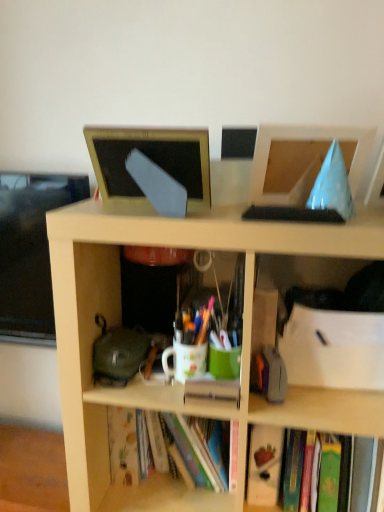
Question: From a real-world perspective, is translucent plastic pen at center physically located above or below hardcover book at lower right?

Choices:
 (A) above
 (B) below

Answer: (A)

Question: Is point (281, 380) closer or farther from the camera than point (357, 505)?

Choices:
 (A) closer
 (B) farther

Answer: (A)

Question: Estimate the real-world distances between objects in this image. Which object is closer to the matte gold frame at upper center, arranged as the 1th computer monitor when viewed from the left?

Choices:
 (A) translucent plastic pen at center
 (B) hardcover book at lower right
 (C) blue paper cone at upper right, marked as the 1th computer monitor in a right-to-left arrangement

Answer: (C)

Question: Which of these objects is positioned farthest from the blue paper cone at upper right, the 2th computer monitor in the left-to-right sequence?

Choices:
 (A) translucent plastic pen at center
 (B) matte gold frame at upper center, the 2th computer monitor viewed from the right
 (C) hardcover book at lower right

Answer: (C)